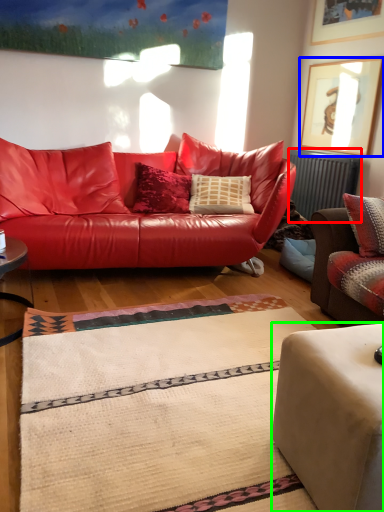
Question: Which object is the closest to the radiator (highlighted by a red box)? Choose among these: picture frame (highlighted by a blue box) or studio couch (highlighted by a green box).

Choices:
 (A) picture frame
 (B) studio couch

Answer: (A)